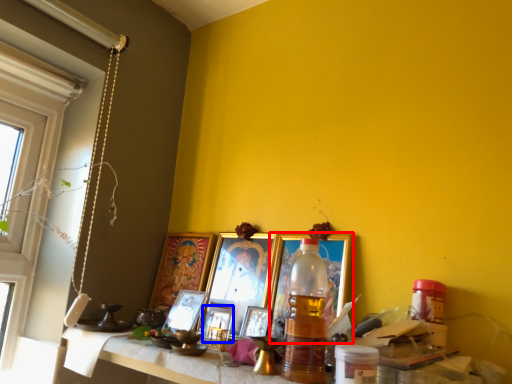
Question: Which object appears closest to the camera in this image, picture frame (highlighted by a red box) or picture frame (highlighted by a blue box)?

Choices:
 (A) picture frame
 (B) picture frame

Answer: (A)